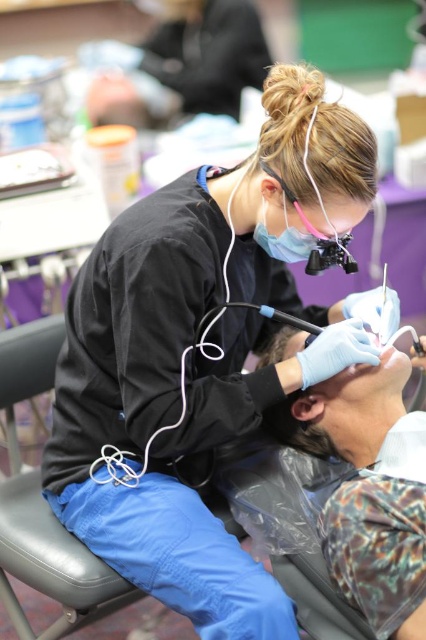
You are a dental assistant and need to adjust the height of the black leather chair at lower left so that the matte blue shirt at center can reach the patient comfortably. Based on the current setup, should you raise or lower the chair?

The matte blue shirt at center is not as tall as the black leather chair at lower left, so to allow the dental professional in the matte blue shirt at center to reach the patient comfortably, you should lower the black leather chair at lower left.

Based on the photo, you are a patient entering the dental clinic and see the image. You need to sit in the black leather chair at lower left. Which direction should you move relative to the matte blue shirt at center?

The matte blue shirt at center is positioned on the right side of the black leather chair at lower left. Therefore, you should move to the left relative to the matte blue shirt at center to reach the black leather chair at lower left.